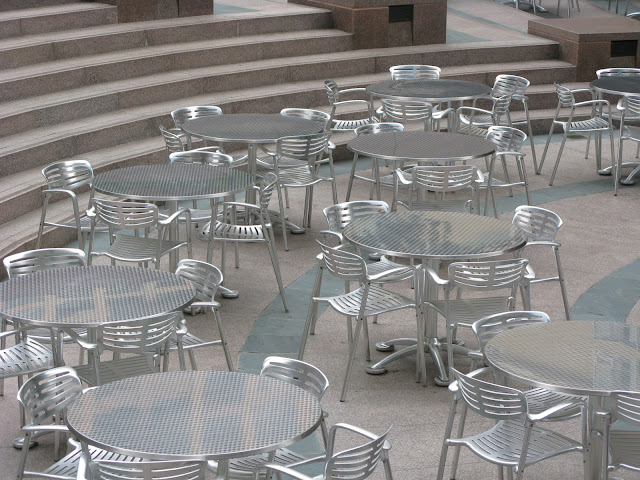
Find the location of a particular element. The image size is (640, 480). table 5 chairs is located at coordinates (75, 169), (265, 187), (202, 158).